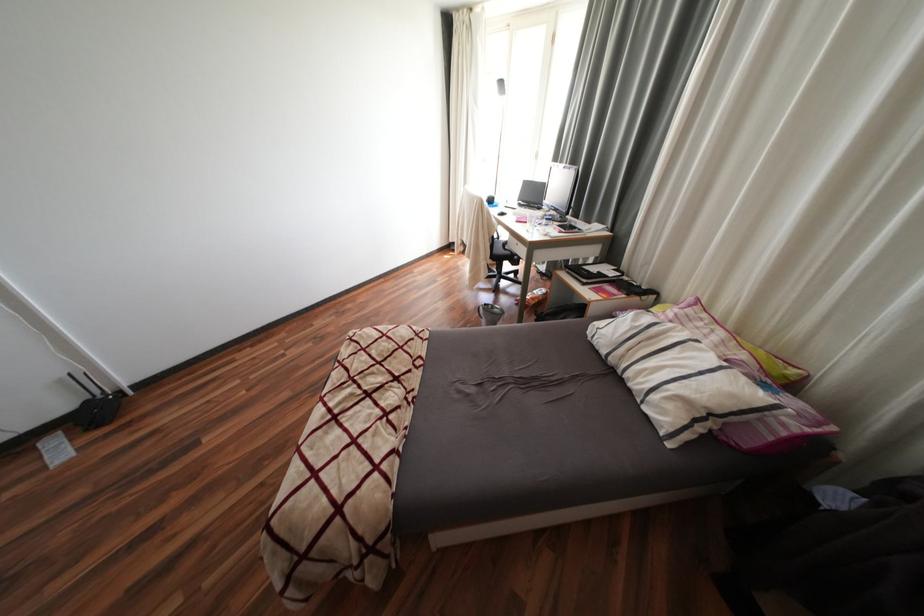
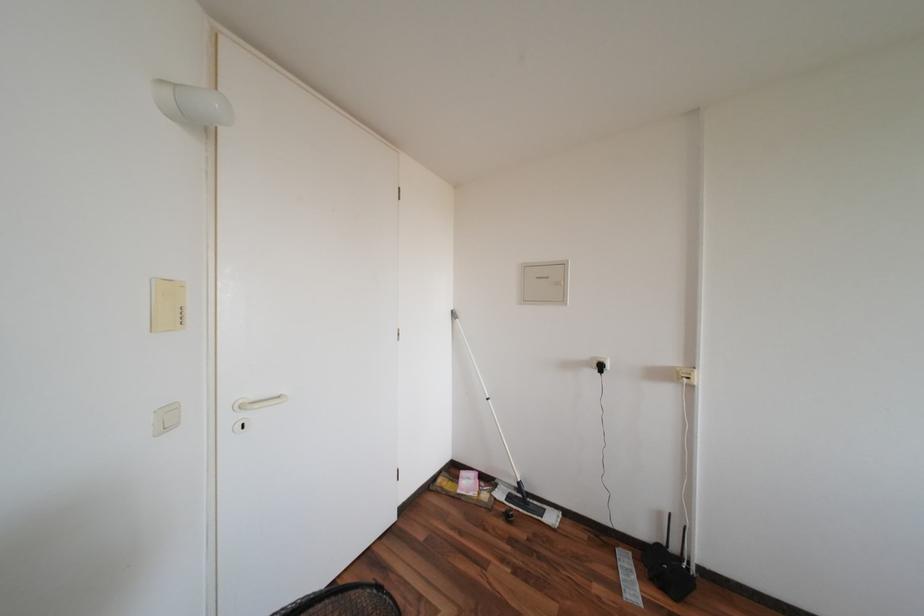
Question: The camera is either moving clockwise (left) or counter-clockwise (right) around the object. The first image is from the beginning of the video and the second image is from the end. Is the camera moving left or right when shooting the video?

Choices:
 (A) Left
 (B) Right

Answer: (B)